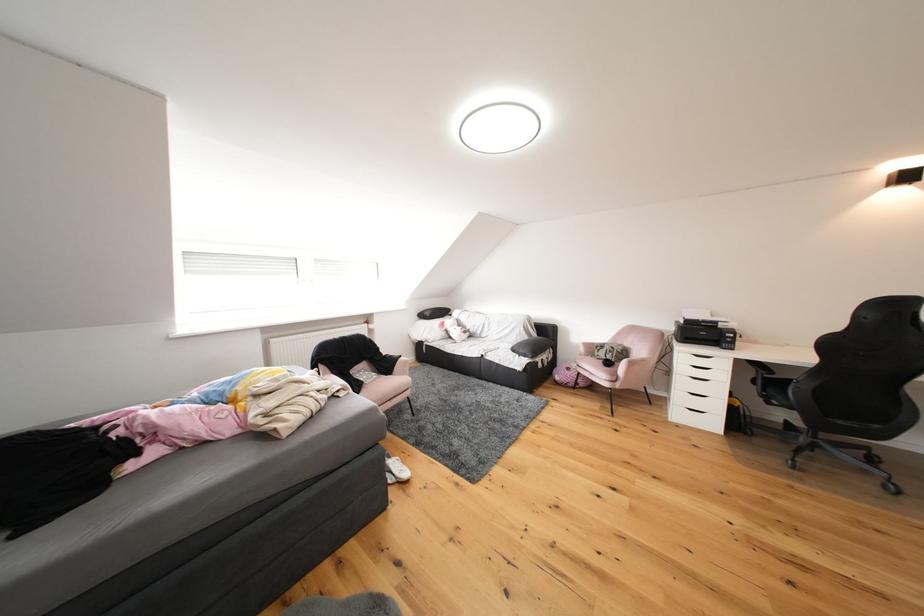
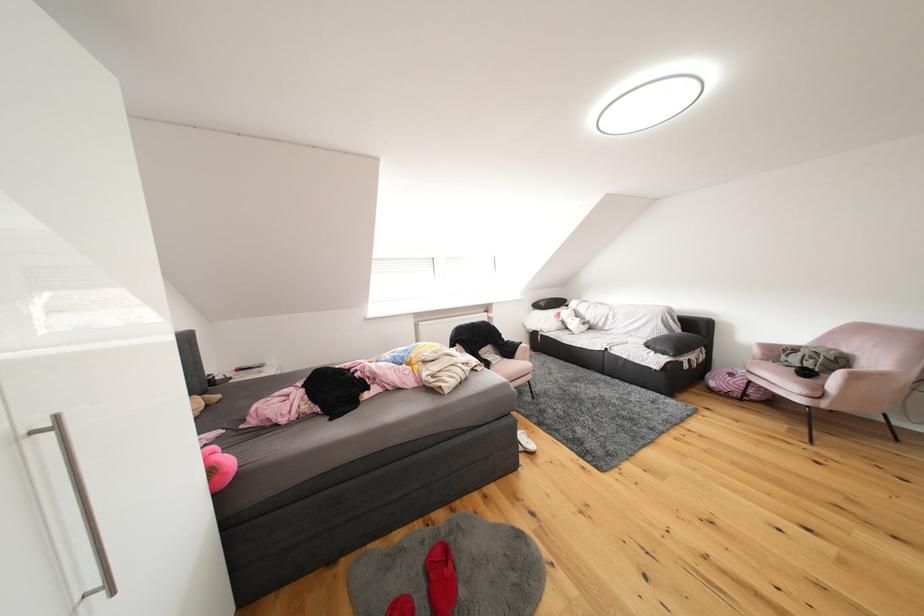
Where in the second image is the point corresponding to pixel 609 379 from the first image?

(797, 392)